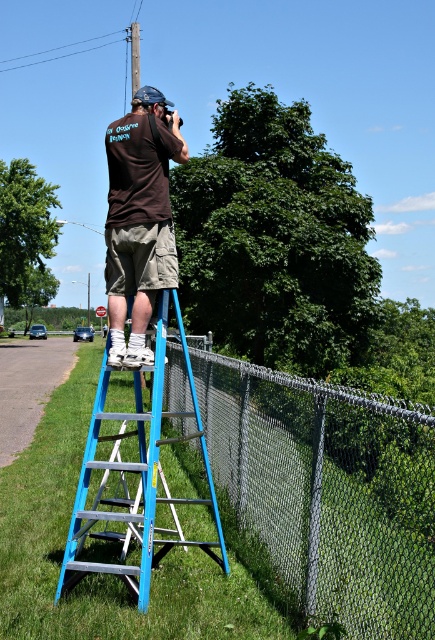
Who is positioned more to the right, brown cotton shirt at center or brushed metal power line at upper center?

brown cotton shirt at center

Can you confirm if brown cotton shirt at center is positioned to the left of brushed metal power line at upper center?

Incorrect, brown cotton shirt at center is not on the left side of brushed metal power line at upper center.

Describe the element at coordinates (140, 218) in the screenshot. I see `brown cotton shirt at center` at that location.

I want to click on brown cotton shirt at center, so click(x=140, y=218).

Does gray chain-link fence at right have a lesser width compared to brown cotton shirt at center?

Yes.

Does gray chain-link fence at right appear on the right side of brown cotton shirt at center?

Indeed, gray chain-link fence at right is positioned on the right side of brown cotton shirt at center.

Who is more forward, (368, 566) or (143, 257)?

Point (368, 566) is in front.

Find the location of `gray chain-link fence at right`. gray chain-link fence at right is located at coordinates (327, 490).

Between point (19, 60) and point (134, 90), which one is positioned in front?

Point (134, 90) is in front.

Where is `brushed metal power line at upper center`? The width and height of the screenshot is (435, 640). brushed metal power line at upper center is located at coordinates (70, 45).